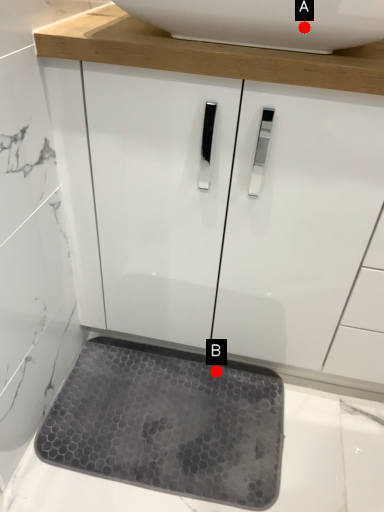
Question: Two points are circled on the image, labeled by A and B beside each circle. Which point appears closest to the camera in this image?

Choices:
 (A) A is closer
 (B) B is closer

Answer: (A)